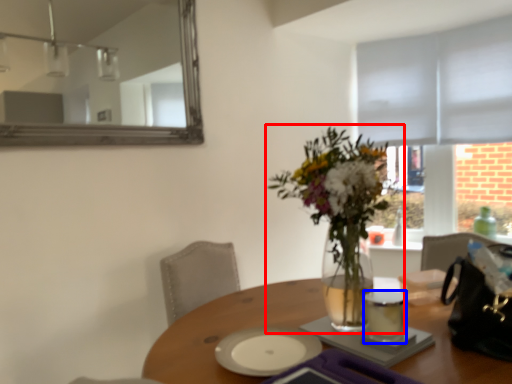
Question: Which object appears closest to the camera in this image, houseplant (highlighted by a red box) or tableware (highlighted by a blue box)?

Choices:
 (A) houseplant
 (B) tableware

Answer: (A)